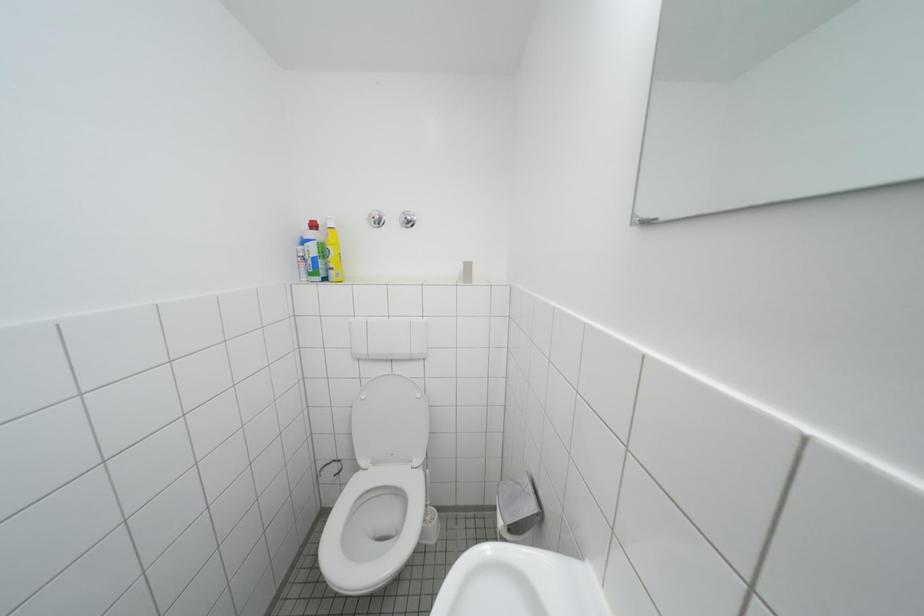
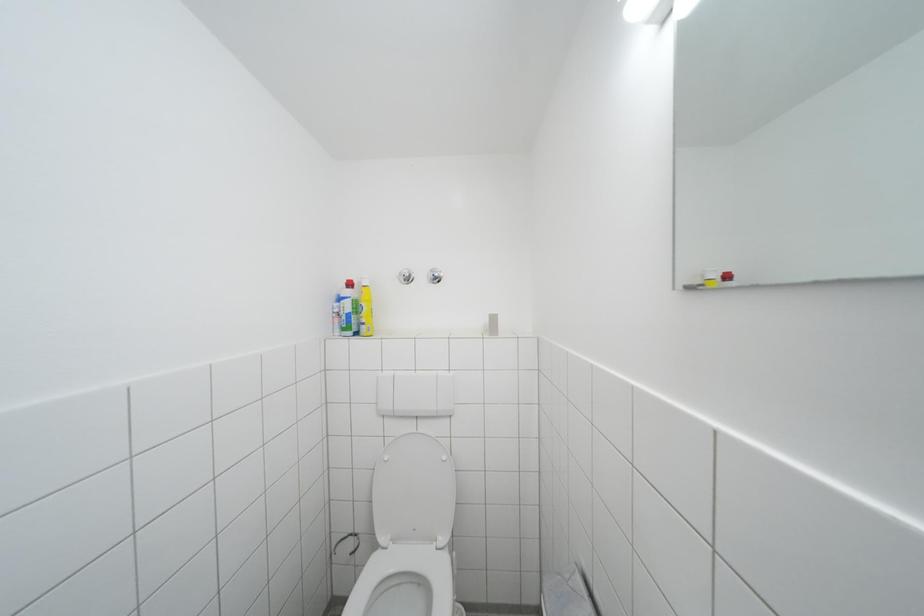
Question: The first image is from the beginning of the video and the second image is from the end. How did the camera likely rotate when shooting the video?

Choices:
 (A) Left
 (B) Right
 (C) Up
 (D) Down

Answer: (C)